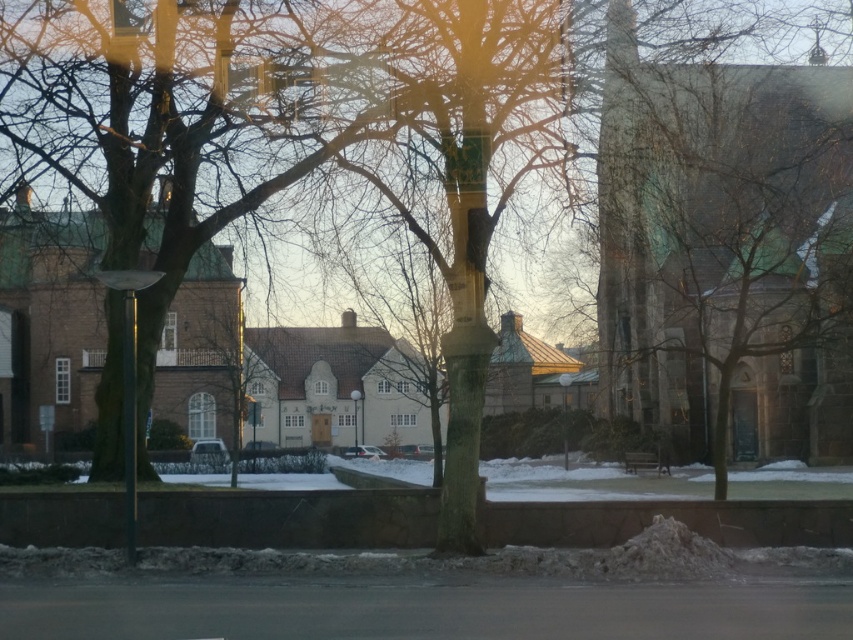
Question: Is brown textured tree at left wider than metallic pole at center?

Choices:
 (A) yes
 (B) no

Answer: (A)

Question: Can you confirm if smooth gray stone church tower at right is wider than metallic pole at center?

Choices:
 (A) no
 (B) yes

Answer: (B)

Question: Can you confirm if smooth gray stone church tower at right is positioned to the right of brown textured tree at left?

Choices:
 (A) no
 (B) yes

Answer: (B)

Question: Among these points, which one is nearest to the camera?

Choices:
 (A) (618, 388)
 (B) (138, 16)
 (C) (126, 396)

Answer: (C)

Question: Which of the following is the farthest from the observer?

Choices:
 (A) (210, 138)
 (B) (628, 356)
 (C) (134, 362)

Answer: (B)

Question: Which point is farther to the camera?

Choices:
 (A) brown textured tree at left
 (B) metallic pole at center

Answer: (A)